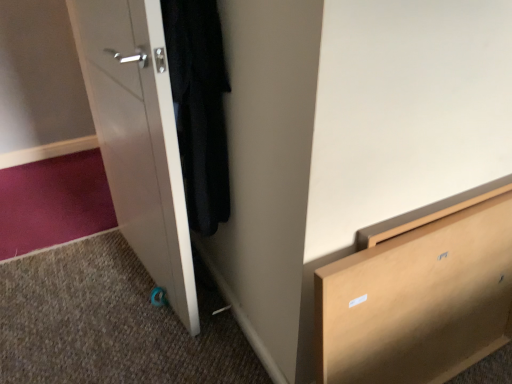
Locate an element on the screen. The height and width of the screenshot is (384, 512). vacant region in front of white glossy door at left is located at coordinates (122, 342).